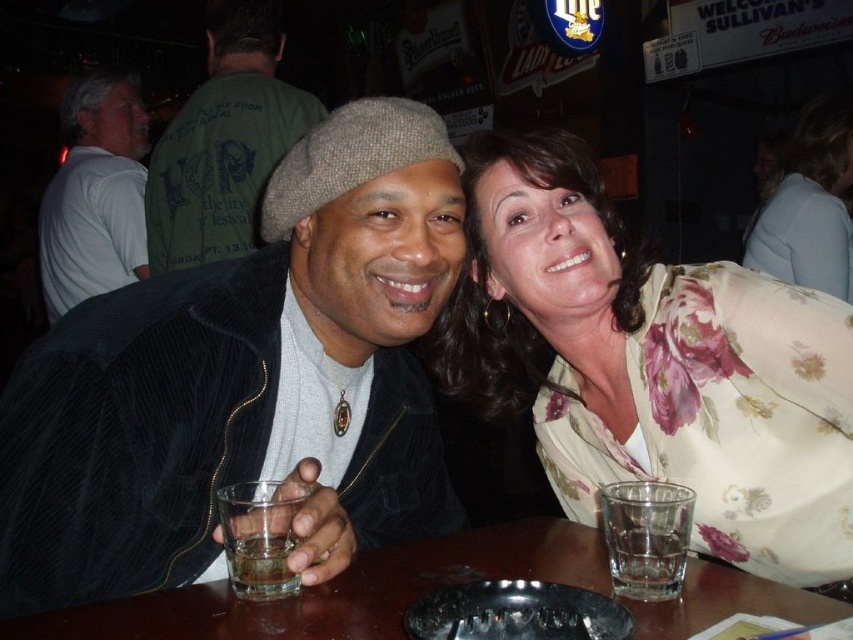
The corduroy jacket at center is worn by a man. If the man wants to hand his whiskey glass to the woman sitting next to him, will he be able to do so without moving from his seat?

The man and woman are 27.81 inches apart. Since the average arm span allows reaching about 24 to 30 inches, the distance is within reach, so yes, he can hand his glass to the woman without moving from his seat.

Based on the scene described, where is the transparent glass at center in relation to the green corduroy jacket at upper left?

The transparent glass at center is to the right of the green corduroy jacket at upper left.

You are a bartender who needs to place a new drink order between the transparent glass at center and the white cotton shirt at left. According to the scene, where should you place it to maintain the existing arrangement?

The transparent glass at center is to the right of the white cotton shirt at left, so place the new drink order to the right of the white cotton shirt at left and to the left of the transparent glass at center to maintain the existing arrangement.